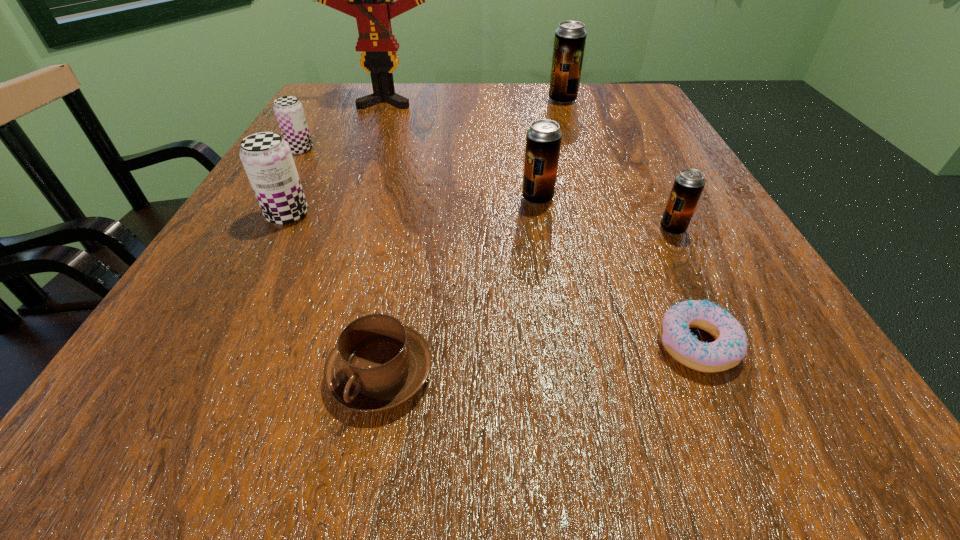
You are a GUI agent. You are given a task and a screenshot of the screen. Output one action in this format:
    pyautogui.click(x=<x>, y=<y>)
    Task: Click on the vacant space at the left edge
    The width and height of the screenshot is (960, 540).
    Given the screenshot: What is the action you would take?
    pyautogui.click(x=246, y=366)

In the image, there is a desktop. Identify the location of vacant region at the right edge. The image size is (960, 540). (754, 350).

This screenshot has width=960, height=540. In the image, there is a desktop. In order to click on vacant space at the far left corner in this screenshot , I will do `click(341, 100)`.

Identify the location of vacant position at the far right corner of the desktop. The height and width of the screenshot is (540, 960). tap(584, 112).

Identify the location of vacant area at the near right corner of the desktop. This screenshot has width=960, height=540. click(700, 404).

I want to click on unoccupied position between the fourth object from right to left and the rightmost beer can, so click(x=605, y=213).

Where is `vacant region between the purple doughnut and the nearer purple beer can`? The height and width of the screenshot is (540, 960). vacant region between the purple doughnut and the nearer purple beer can is located at coordinates (492, 280).

Image resolution: width=960 pixels, height=540 pixels. Find the location of `free space that is in between the tallest object and the fourth nearest beer can`. free space that is in between the tallest object and the fourth nearest beer can is located at coordinates (343, 125).

Locate an element on the screen. blank region between the second biggest black beer can and the nutcracker is located at coordinates point(462,150).

Where is `blank region between the cappuccino and the fifth object from left to right`? This screenshot has height=540, width=960. blank region between the cappuccino and the fifth object from left to right is located at coordinates (459, 286).